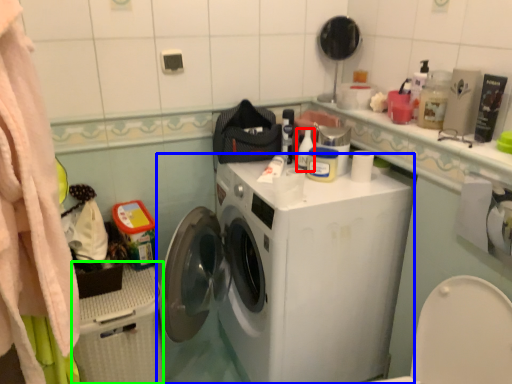
Question: Which object is the closest to the cleaning product (highlighted by a red box)? Choose among these: washing machine (highlighted by a blue box) or dish washer (highlighted by a green box).

Choices:
 (A) washing machine
 (B) dish washer

Answer: (A)